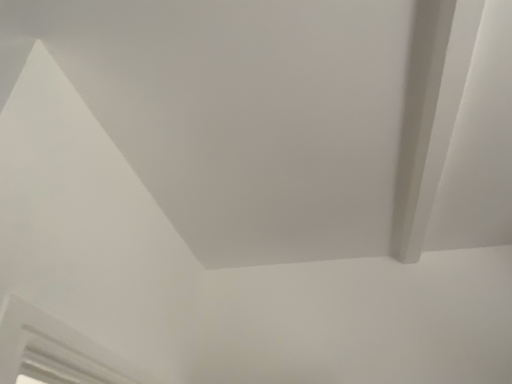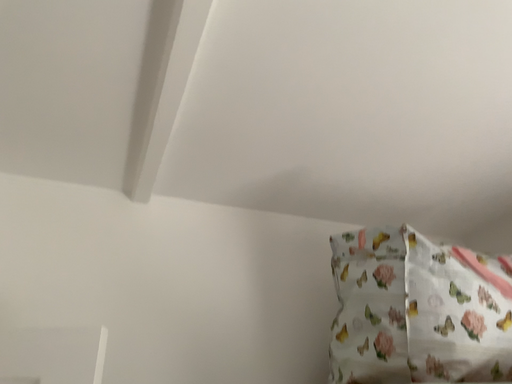
Question: Which way did the camera rotate in the video?

Choices:
 (A) rotated right
 (B) rotated left

Answer: (A)